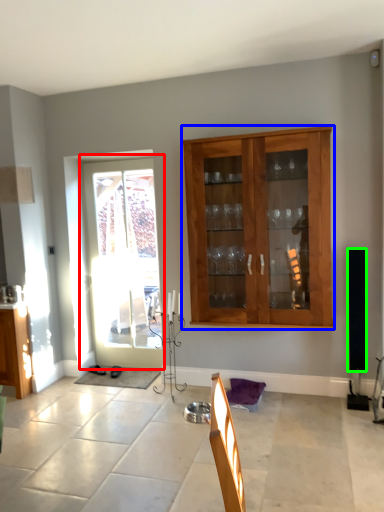
Question: Considering the real-world distances, which object is farthest from door (highlighted by a red box)? cabinet (highlighted by a blue box) or loudspeaker (highlighted by a green box)?

Choices:
 (A) cabinet
 (B) loudspeaker

Answer: (B)